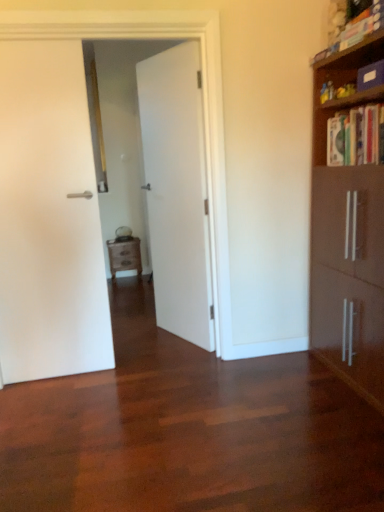
In order to face wooden nightstand at center, should I rotate leftwards or rightwards?

It's best to rotate left around 8.697 degrees.

Looking at this image, how much space does white matte door at left, arranged as the first door when viewed from the left, occupy vertically?

6.47 feet.

I want to click on hardcover book at upper right, the first book positioned from the bottom, so click(355, 136).

Locate an element on the screen. The image size is (384, 512). hardcover book at upper right, which is the second book from bottom to top is located at coordinates (355, 30).

Considering the positions of objects hardcover book at upper right, which is the second book from bottom to top, and hardcover book at upper right, the first book positioned from the bottom, in the image provided, who is more to the left, hardcover book at upper right, which is the second book from bottom to top, or hardcover book at upper right, the first book positioned from the bottom,?

Positioned to the left is hardcover book at upper right, which is the second book from bottom to top.

I want to click on book on the left of hardcover book at upper right, the first book positioned from the bottom, so point(355,30).

Is the depth of hardcover book at upper right, the 1th book viewed from the top, less than that of hardcover book at upper right, arranged as the second book when viewed from the top?

No.

Is hardcover book at upper right, the 1th book viewed from the top, positioned with its back to hardcover book at upper right, the first book positioned from the bottom?

hardcover book at upper right, the 1th book viewed from the top, does not have its back to hardcover book at upper right, the first book positioned from the bottom.

From the image's perspective, is white matte door at center, the 2th door positioned from the left, on top of white matte door at left, arranged as the first door when viewed from the left?

Indeed, from the image's perspective, white matte door at center, the 2th door positioned from the left, is shown above white matte door at left, arranged as the first door when viewed from the left.

Is white matte door at center, placed as the 1th door when sorted from right to left, in front of or behind white matte door at left, which appears as the second door when viewed from the right, in the image?

Clearly, white matte door at center, placed as the 1th door when sorted from right to left, is behind white matte door at left, which appears as the second door when viewed from the right.

Is white matte door at center, the 2th door positioned from the left, facing towards white matte door at left, which appears as the second door when viewed from the right?

Yes, white matte door at center, the 2th door positioned from the left, faces towards white matte door at left, which appears as the second door when viewed from the right.

Which is in front, wooden nightstand at center or hardcover book at upper right, arranged as the second book when viewed from the top?

hardcover book at upper right, arranged as the second book when viewed from the top, is in front.

Between point (115, 249) and point (343, 163), which one is positioned behind?

The point (115, 249) is behind.

How far apart are wooden nightstand at center and hardcover book at upper right, arranged as the second book when viewed from the top?

wooden nightstand at center and hardcover book at upper right, arranged as the second book when viewed from the top, are 3.41 meters apart from each other.

Could you tell me if wooden nightstand at center is turned towards hardcover book at upper right, arranged as the second book when viewed from the top?

No.

Is white matte door at center, placed as the 1th door when sorted from right to left, a part of wooden nightstand at center?

Definitely not — white matte door at center, placed as the 1th door when sorted from right to left, is not inside wooden nightstand at center.

Who is bigger, wooden nightstand at center or white matte door at center, the 2th door positioned from the left?

white matte door at center, the 2th door positioned from the left.

Which object is positioned more to the left, wooden nightstand at center or white matte door at center, the 2th door positioned from the left?

wooden nightstand at center.

Does wooden nightstand at center have a larger size compared to white matte door at left, arranged as the first door when viewed from the left?

Indeed, wooden nightstand at center has a larger size compared to white matte door at left, arranged as the first door when viewed from the left.

Is wooden nightstand at center spatially inside white matte door at left, arranged as the first door when viewed from the left, or outside of it?

wooden nightstand at center is not enclosed by white matte door at left, arranged as the first door when viewed from the left.

Is wooden nightstand at center oriented towards white matte door at left, arranged as the first door when viewed from the left?

Yes, wooden nightstand at center is facing white matte door at left, arranged as the first door when viewed from the left.

Between hardcover book at upper right, which is the second book from bottom to top, and wooden nightstand at center, which one has more height?

wooden nightstand at center is taller.

Looking at this image, from the image's perspective, which object appears higher, hardcover book at upper right, which is the second book from bottom to top, or wooden nightstand at center?

From the image's view, hardcover book at upper right, which is the second book from bottom to top, is above.

Is hardcover book at upper right, the 1th book viewed from the top, positioned far away from wooden nightstand at center?

Absolutely, hardcover book at upper right, the 1th book viewed from the top, is distant from wooden nightstand at center.

Considering the sizes of hardcover book at upper right, the 1th book viewed from the top, and wooden nightstand at center in the image, is hardcover book at upper right, the 1th book viewed from the top, wider or thinner than wooden nightstand at center?

In the image, hardcover book at upper right, the 1th book viewed from the top, appears to be more narrow than wooden nightstand at center.

Between white matte door at center, placed as the 1th door when sorted from right to left, and hardcover book at upper right, arranged as the second book when viewed from the top, which one is positioned behind?

white matte door at center, placed as the 1th door when sorted from right to left, is more distant.

How many degrees apart are the facing directions of white matte door at center, placed as the 1th door when sorted from right to left, and hardcover book at upper right, the first book positioned from the bottom?

The angular difference between white matte door at center, placed as the 1th door when sorted from right to left, and hardcover book at upper right, the first book positioned from the bottom, is 22.6 degrees.

Is white matte door at center, the 2th door positioned from the left, facing away from hardcover book at upper right, the first book positioned from the bottom?

No, white matte door at center, the 2th door positioned from the left,'s orientation is not away from hardcover book at upper right, the first book positioned from the bottom.

In the scene shown: Between white matte door at center, the 2th door positioned from the left, and hardcover book at upper right, arranged as the second book when viewed from the top, which one appears on the left side from the viewer's perspective?

From the viewer's perspective, white matte door at center, the 2th door positioned from the left, appears more on the left side.

This screenshot has height=512, width=384. I want to click on book behind the hardcover book at upper right, arranged as the second book when viewed from the top, so click(355, 30).

I want to click on door on the left of white matte door at center, the 2th door positioned from the left, so click(49, 218).

Based on their spatial positions, is hardcover book at upper right, which is the second book from bottom to top, or wooden nightstand at center closer to hardcover book at upper right, the first book positioned from the bottom?

hardcover book at upper right, which is the second book from bottom to top, lies closer to hardcover book at upper right, the first book positioned from the bottom, than the other object.

In the scene shown: Which object lies further to the anchor point white matte door at center, placed as the 1th door when sorted from right to left, wooden nightstand at center or white matte door at left, arranged as the first door when viewed from the left?

wooden nightstand at center.

Considering their positions, is wooden nightstand at center positioned further to white matte door at left, which appears as the second door when viewed from the right, than hardcover book at upper right, the first book positioned from the bottom?

The object further to white matte door at left, which appears as the second door when viewed from the right, is wooden nightstand at center.

From the image, which object appears to be farther from hardcover book at upper right, the first book positioned from the bottom, hardcover book at upper right, which is the second book from bottom to top, or white matte door at left, arranged as the first door when viewed from the left?

white matte door at left, arranged as the first door when viewed from the left.

Estimate the real-world distances between objects in this image. Which object is closer to white matte door at left, which appears as the second door when viewed from the right, hardcover book at upper right, the first book positioned from the bottom, or hardcover book at upper right, which is the second book from bottom to top?

hardcover book at upper right, the first book positioned from the bottom, is closer to white matte door at left, which appears as the second door when viewed from the right.

Based on their spatial positions, is hardcover book at upper right, the 1th book viewed from the top, or white matte door at center, placed as the 1th door when sorted from right to left, closer to white matte door at left, arranged as the first door when viewed from the left?

white matte door at center, placed as the 1th door when sorted from right to left, is positioned closer to the anchor white matte door at left, arranged as the first door when viewed from the left.

When comparing their distances from wooden nightstand at center, does hardcover book at upper right, the 1th book viewed from the top, or white matte door at left, arranged as the first door when viewed from the left, seem closer?

The object closer to wooden nightstand at center is white matte door at left, arranged as the first door when viewed from the left.

In the scene shown: Looking at the image, which one is located closer to white matte door at left, arranged as the first door when viewed from the left, white matte door at center, the 2th door positioned from the left, or hardcover book at upper right, arranged as the second book when viewed from the top?

The object closer to white matte door at left, arranged as the first door when viewed from the left, is white matte door at center, the 2th door positioned from the left.

Image resolution: width=384 pixels, height=512 pixels. Identify the location of door between white matte door at left, arranged as the first door when viewed from the left, and hardcover book at upper right, arranged as the second book when viewed from the top, from left to right. (177, 191).

This screenshot has width=384, height=512. In order to click on door between white matte door at left, arranged as the first door when viewed from the left, and wooden nightstand at center from front to back in this screenshot , I will do `click(177, 191)`.

Find the location of a particular element. door between white matte door at left, arranged as the first door when viewed from the left, and hardcover book at upper right, the 1th book viewed from the top, from left to right is located at coordinates (177, 191).

Identify the location of book between white matte door at left, which appears as the second door when viewed from the right, and hardcover book at upper right, arranged as the second book when viewed from the top, in the horizontal direction. (355, 30).